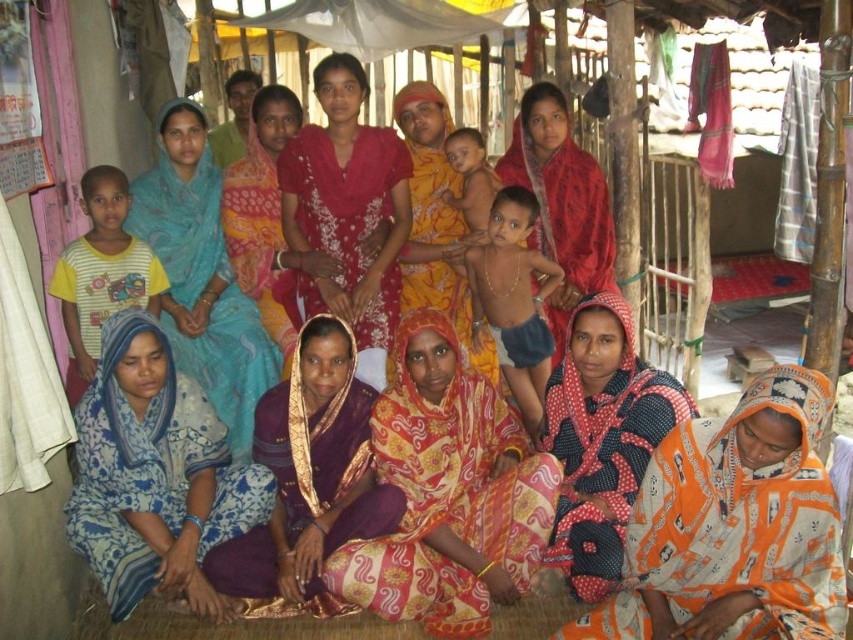
Question: Among these objects, which one is nearest to the camera?

Choices:
 (A) printed fabric saree at center
 (B) matte red saree at center
 (C) yellow striped shirt at left
 (D) matte gold necklace at center

Answer: (A)

Question: Among these points, which one is farthest from the camera?

Choices:
 (A) (322, 541)
 (B) (457, 602)
 (C) (142, 324)
 (D) (296, 108)

Answer: (D)

Question: Considering the real-world distances, which object is closest to the light brown skin at center?

Choices:
 (A) yellow striped shirt at left
 (B) blue printed saree at left
 (C) polka dot fabric at lower right
 (D) blue printed fabric at lower left

Answer: (B)

Question: Where is polka dot fabric at lower right located in relation to matte red saree at center in the image?

Choices:
 (A) above
 (B) below

Answer: (B)

Question: Is printed cotton sari at lower right thinner than polka dot fabric at lower right?

Choices:
 (A) yes
 (B) no

Answer: (B)

Question: Can you confirm if purple satin saree at center is positioned above polka dot fabric at lower right?

Choices:
 (A) yes
 (B) no

Answer: (B)